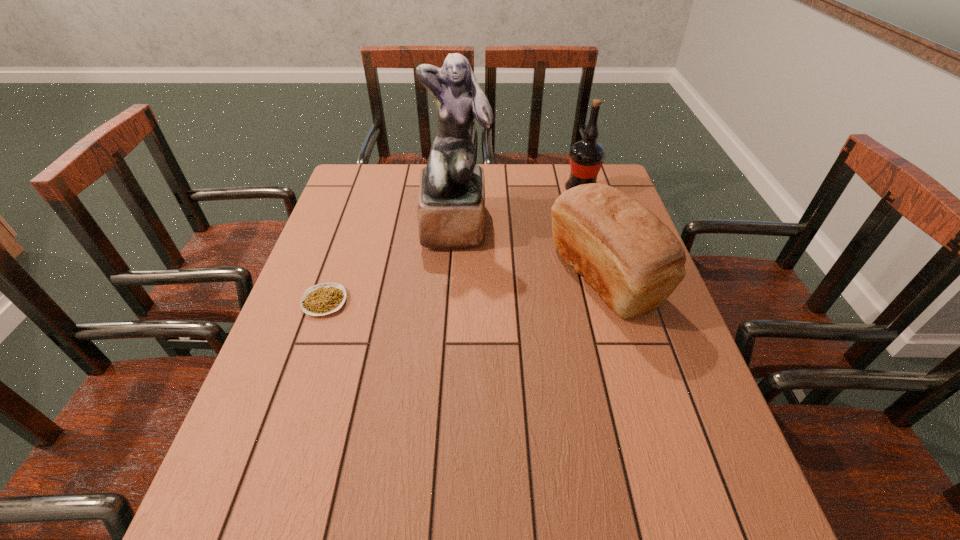
Where is `object that is the third nearest to the wine bottle`? Image resolution: width=960 pixels, height=540 pixels. object that is the third nearest to the wine bottle is located at coordinates (325, 298).

Point out which object is positioned as the third nearest to the wine bottle. Please provide its 2D coordinates. Your answer should be formatted as a tuple, i.e. [(x, y)], where the tuple contains the x and y coordinates of a point satisfying the conditions above.

[(325, 298)]

The width and height of the screenshot is (960, 540). I want to click on free spot that satisfies the following two spatial constraints: 1. in a relaxed pose on the second shortest object; 2. on the right side of the tallest object, so click(453, 276).